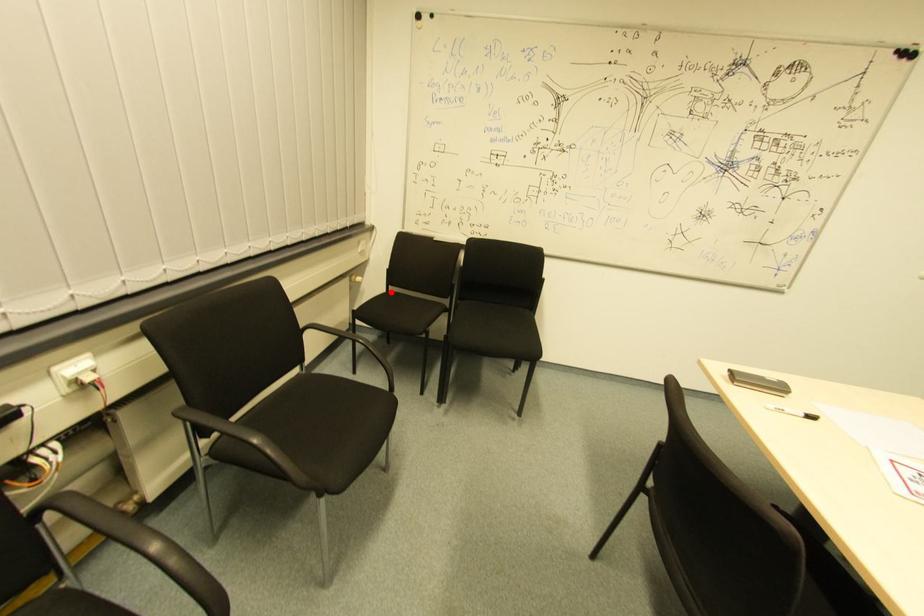
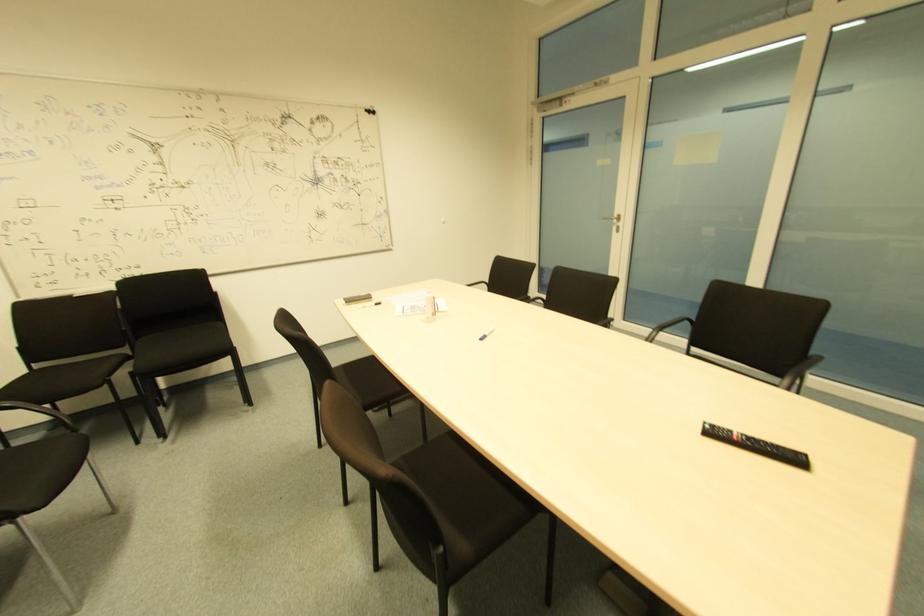
Question: A red point is marked in image1. In image2, is the corresponding 3D point closer to the camera or farther? Reply with the corresponding letter.

Choices:
 (A) The corresponding 3D point is closer.
 (B) The corresponding 3D point is farther.

Answer: (B)